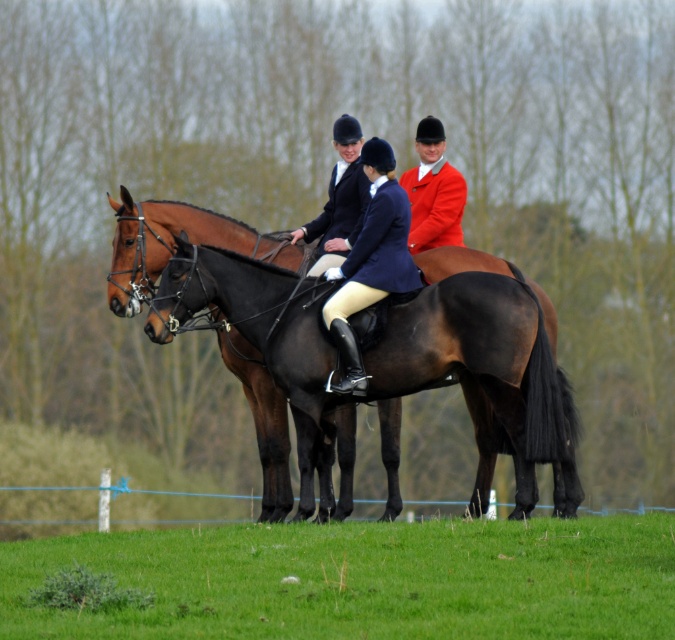
In the scene shown: Who is shorter, brown glossy horse at center or matte black jacket at center?

With less height is brown glossy horse at center.

Does brown glossy horse at center appear over matte black jacket at center?

Incorrect, brown glossy horse at center is not positioned above matte black jacket at center.

Who is more distant from viewer, (x=163, y=257) or (x=321, y=244)?

The point (x=321, y=244) is more distant.

Find the location of `brown glossy horse at center`. brown glossy horse at center is located at coordinates (171, 243).

Which is more to the left, matte black riding jacket at center or matte red coat at center?

From the viewer's perspective, matte black riding jacket at center appears more on the left side.

Is matte black riding jacket at center above matte red coat at center?

No, matte black riding jacket at center is not above matte red coat at center.

Who is more forward, [404,234] or [425,243]?

Point [404,234] is in front.

Identify the location of matte black riding jacket at center. The image size is (675, 640). (381, 250).

Find the location of a particular element. The width and height of the screenshot is (675, 640). brown glossy horse at center is located at coordinates (171, 243).

Consider the image. How much distance is there between brown glossy horse at center and matte black riding jacket at center?

1.34 meters

This screenshot has width=675, height=640. I want to click on brown glossy horse at center, so click(x=171, y=243).